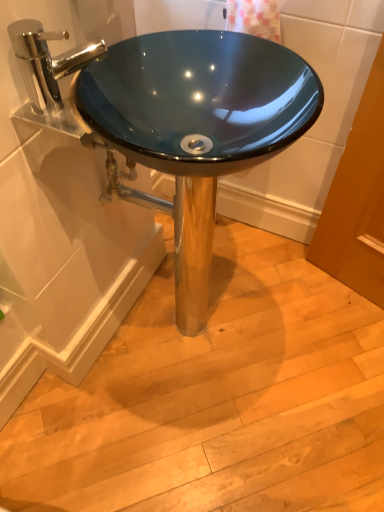
Question: Considering the positions of point (127, 199) and point (46, 102), is point (127, 199) closer or farther from the camera than point (46, 102)?

Choices:
 (A) farther
 (B) closer

Answer: (A)

Question: From a real-world perspective, is glossy blue glass sink at center positioned above or below polished chrome faucet at upper left?

Choices:
 (A) below
 (B) above

Answer: (A)

Question: Is glossy blue glass sink at center wider or thinner than polished chrome faucet at upper left?

Choices:
 (A) thin
 (B) wide

Answer: (B)

Question: Is polished chrome faucet at upper left inside or outside of glossy blue glass sink at center?

Choices:
 (A) outside
 (B) inside

Answer: (A)

Question: In the image, is polished chrome faucet at upper left on the left side or the right side of glossy blue glass sink at center?

Choices:
 (A) left
 (B) right

Answer: (A)

Question: From a real-world perspective, relative to glossy blue glass sink at center, is polished chrome faucet at upper left vertically above or below?

Choices:
 (A) below
 (B) above

Answer: (B)

Question: From their relative heights in the image, would you say polished chrome faucet at upper left is taller or shorter than glossy blue glass sink at center?

Choices:
 (A) tall
 (B) short

Answer: (B)